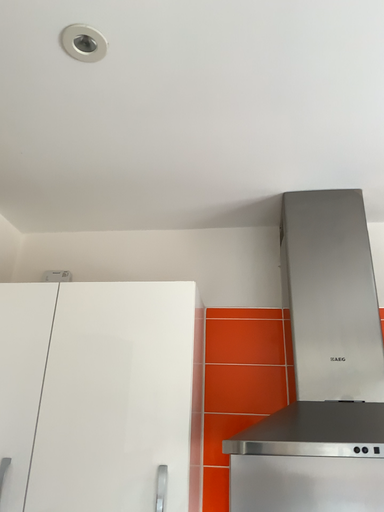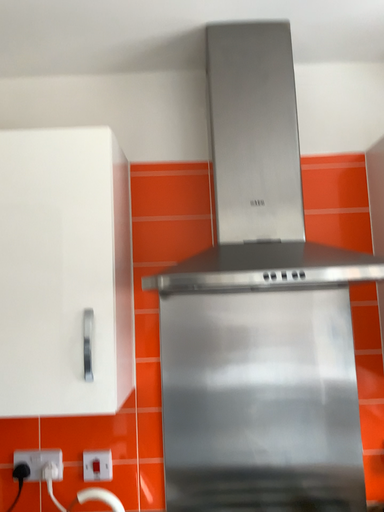
Question: How did the camera likely rotate when shooting the video?

Choices:
 (A) rotated left
 (B) rotated right

Answer: (B)